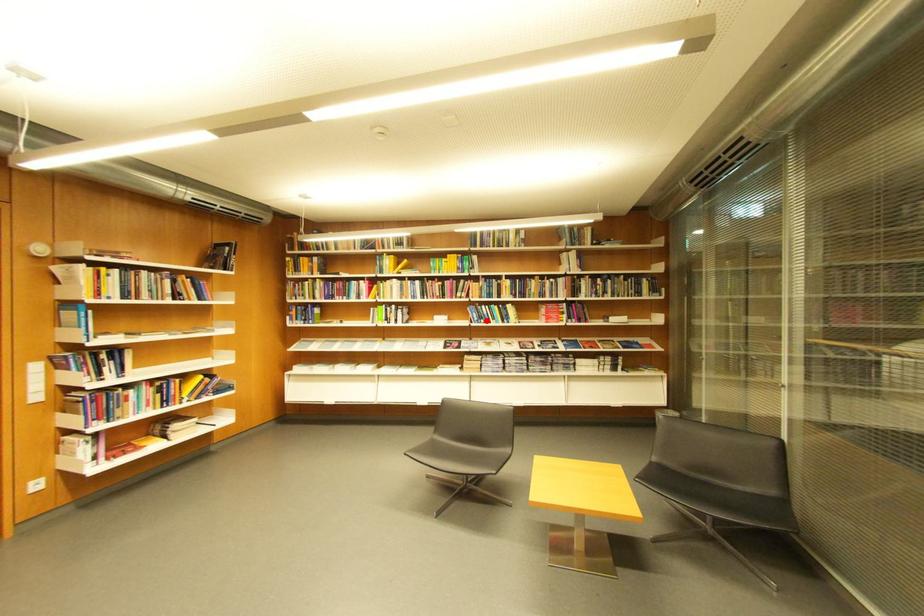
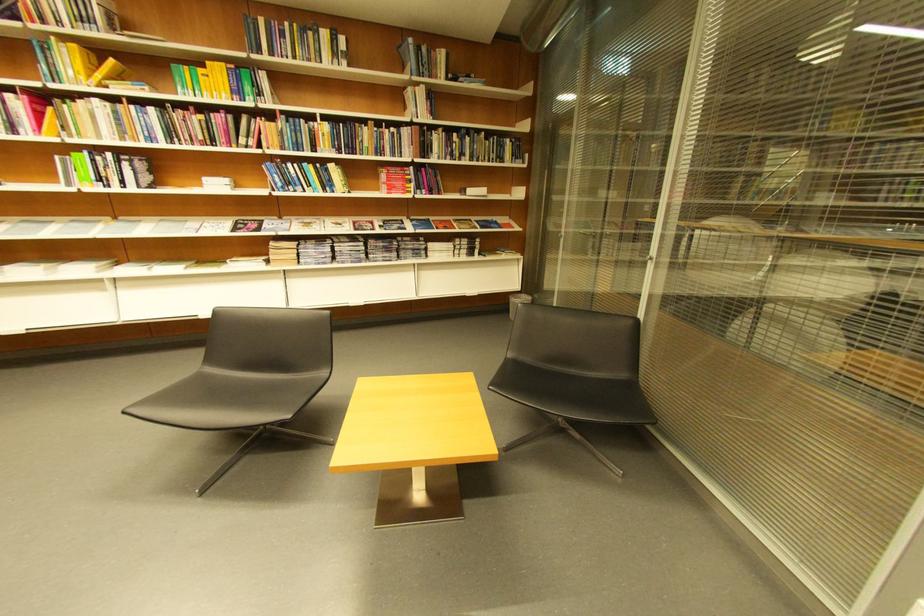
The point at the highlighted location is marked in the first image. Where is the corresponding point in the second image?

(290, 185)